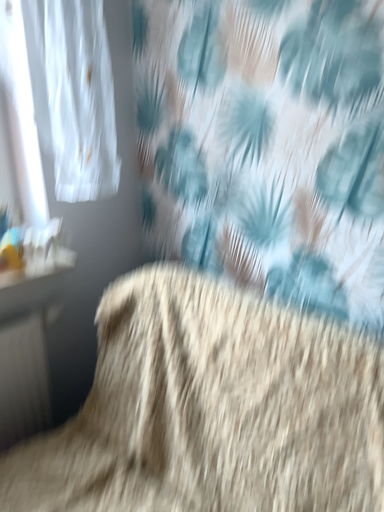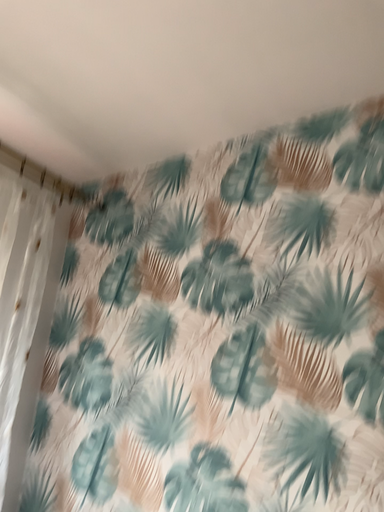
Question: Which way did the camera rotate in the video?

Choices:
 (A) rotated right
 (B) rotated left

Answer: (A)